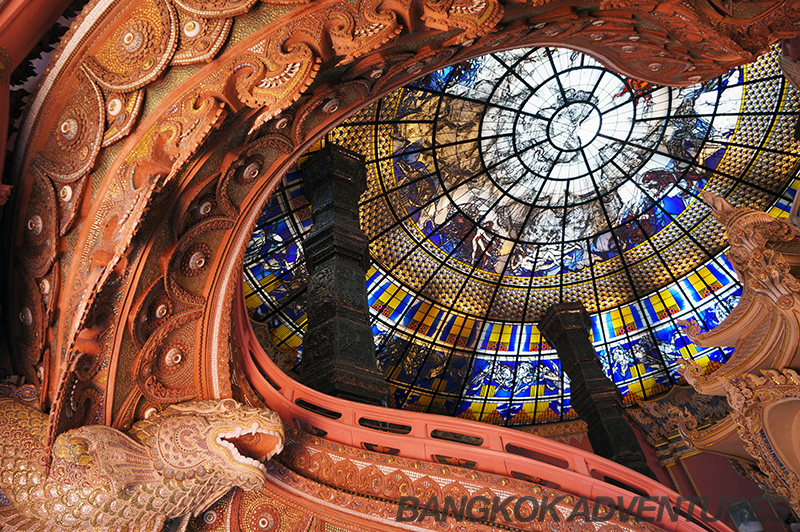
Find the location of a particular element. blue stained glass is located at coordinates (502, 390).